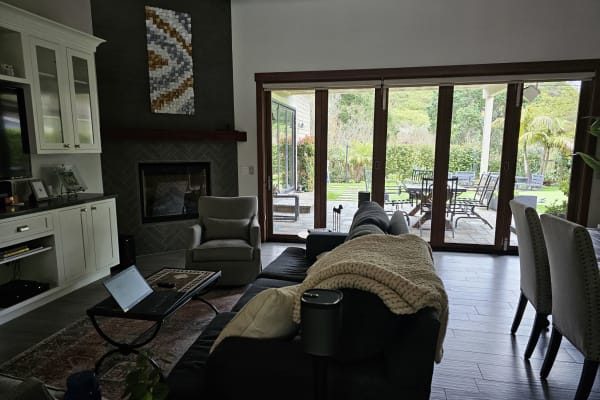
Image resolution: width=600 pixels, height=400 pixels. In order to click on recliner chair in this screenshot , I will do `click(221, 248)`.